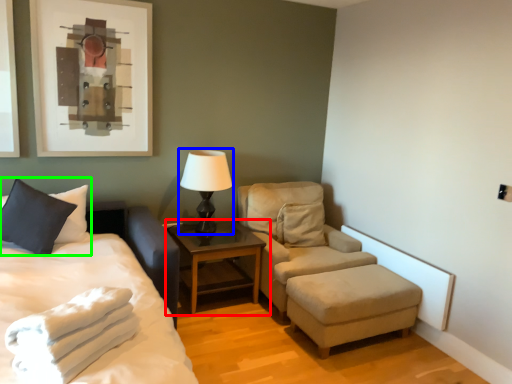
Question: Based on their relative distances, which object is farther from table (highlighted by a red box)? Choose from table lamp (highlighted by a blue box) and pillow (highlighted by a green box).

Choices:
 (A) table lamp
 (B) pillow

Answer: (B)